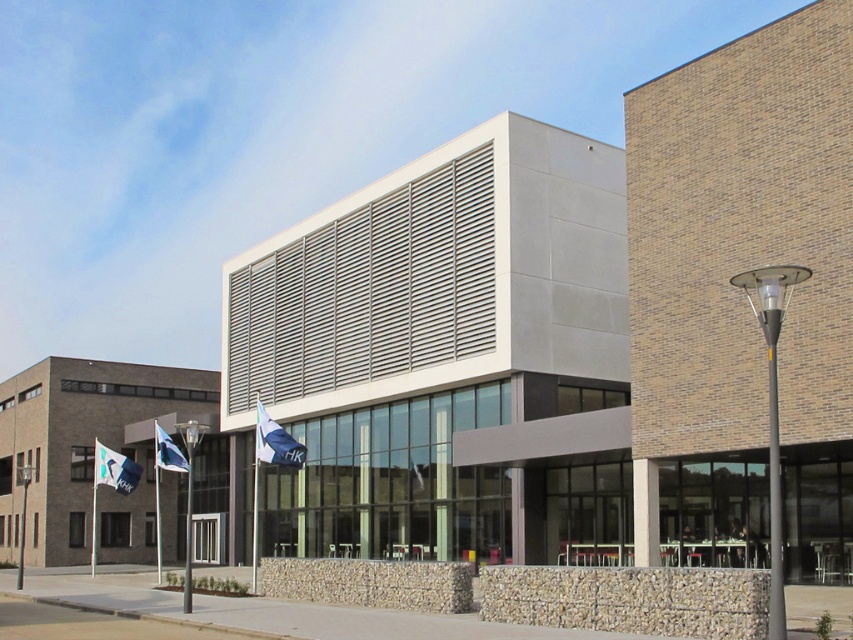
You are a visitor approaching the entrance of the building and see the white fabric flag at center and the metallic gray pole at left. Which object is positioned higher in the scene?

The white fabric flag at center is located above the metallic gray pole at left, so it is positioned higher in the scene.

You are a visitor approaching the entrance of the modern building. You see the black metal pole at right and the white fabric flag at lower left. Which object is positioned higher from the ground?

The black metal pole at right is above the white fabric flag at lower left, so the black metal pole at right is positioned higher from the ground.

You are standing at the entrance of the building and want to locate the black metal lamp post at center. According to the coordinates provided, in which direction should you look relative to your position?

The black metal lamp post at center is located at coordinates point (189, 499). Since you are at the entrance, you should look towards the center of the image to find it.